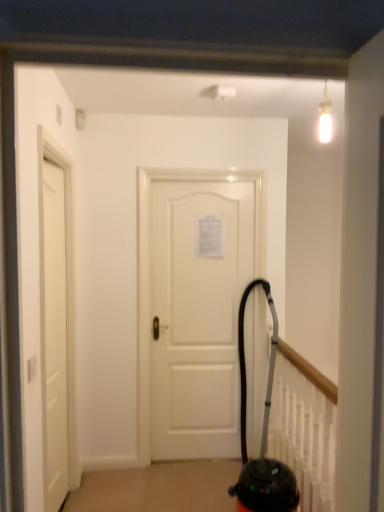
Question: Is white matte door at center, which is the second door in left-to-right order, smaller than black rubber vacuum cleaner at center?

Choices:
 (A) no
 (B) yes

Answer: (B)

Question: Is black rubber vacuum cleaner at center located within white matte door at center, marked as the 2th door in a front-to-back arrangement?

Choices:
 (A) yes
 (B) no

Answer: (B)

Question: Is white matte door at center, which is the second door in left-to-right order, to the left of black rubber vacuum cleaner at center from the viewer's perspective?

Choices:
 (A) yes
 (B) no

Answer: (A)

Question: Is white matte door at center, acting as the first door starting from the right, facing away from black rubber vacuum cleaner at center?

Choices:
 (A) yes
 (B) no

Answer: (B)

Question: Considering the relative sizes of white matte door at center, marked as the 2th door in a front-to-back arrangement, and black rubber vacuum cleaner at center in the image provided, is white matte door at center, marked as the 2th door in a front-to-back arrangement, shorter than black rubber vacuum cleaner at center?

Choices:
 (A) yes
 (B) no

Answer: (B)

Question: Is white matte door at left, arranged as the first door when viewed from the front, situated inside white matte door at center, acting as the first door starting from the right, or outside?

Choices:
 (A) inside
 (B) outside

Answer: (B)

Question: In the image, is white matte door at left, which is counted as the 1th door, starting from the left, positioned in front of or behind white matte door at center, acting as the first door starting from the right?

Choices:
 (A) front
 (B) behind

Answer: (A)

Question: Considering the positions of point (66, 461) and point (230, 384), is point (66, 461) closer or farther from the camera than point (230, 384)?

Choices:
 (A) farther
 (B) closer

Answer: (B)

Question: In terms of width, does white matte door at left, which is counted as the 1th door, starting from the left, look wider or thinner when compared to white matte door at center, the first door viewed from the back?

Choices:
 (A) thin
 (B) wide

Answer: (B)

Question: Does point (226, 238) appear closer or farther from the camera than point (259, 456)?

Choices:
 (A) farther
 (B) closer

Answer: (A)

Question: Considering their positions, is white matte door at center, the first door viewed from the back, located in front of or behind black rubber vacuum cleaner at center?

Choices:
 (A) front
 (B) behind

Answer: (B)

Question: Is white matte door at center, the first door viewed from the back, spatially inside black rubber vacuum cleaner at center, or outside of it?

Choices:
 (A) outside
 (B) inside

Answer: (A)

Question: From the image's perspective, relative to black rubber vacuum cleaner at center, is white matte door at center, which is the second door in left-to-right order, above or below?

Choices:
 (A) below
 (B) above

Answer: (B)

Question: Does point (44, 353) appear closer or farther from the camera than point (288, 503)?

Choices:
 (A) farther
 (B) closer

Answer: (B)

Question: From a real-world perspective, is white matte door at left, which is the second door from back to front, physically located above or below black rubber vacuum cleaner at center?

Choices:
 (A) above
 (B) below

Answer: (A)